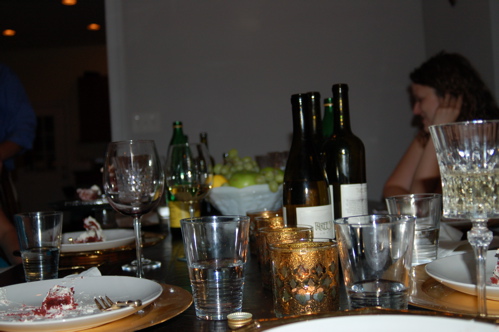
Find the location of `wine glass`. wine glass is located at coordinates (133, 173), (193, 172), (470, 185).